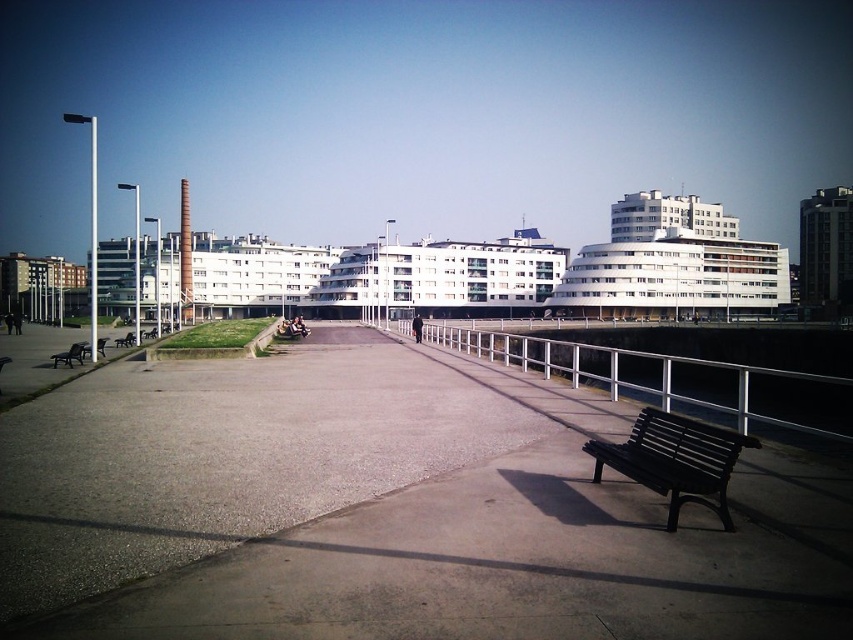
Question: Can you confirm if gray concrete pavement at center is smaller than black wooden bench at left?

Choices:
 (A) yes
 (B) no

Answer: (B)

Question: Can you confirm if white metal rail at center is positioned to the left of matte black bench at left?

Choices:
 (A) yes
 (B) no

Answer: (B)

Question: Estimate the real-world distances between objects in this image. Which object is closer to the wooden bench at center?

Choices:
 (A) dark brown wooden bench at lower right
 (B) matte black bench at left
 (C) black wooden bench at left

Answer: (C)

Question: Which point is closer to the camera?

Choices:
 (A) black plastic bench at lower left
 (B) dark brown wooden bench at lower right

Answer: (B)

Question: Can you confirm if matte black bench at left is smaller than black wooden bench at left?

Choices:
 (A) yes
 (B) no

Answer: (A)

Question: Which point is farther from the camera taking this photo?

Choices:
 (A) (84, 348)
 (B) (634, 458)
 (C) (611, 484)
 (D) (795, 413)

Answer: (D)